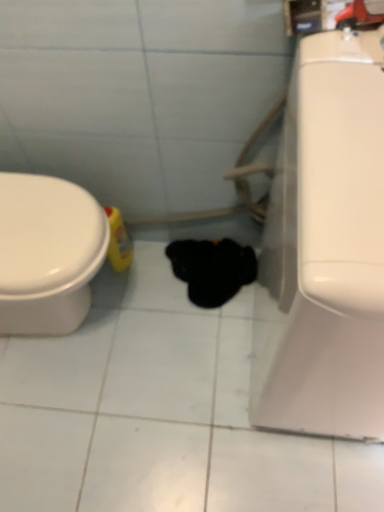
Locate an element on the screen. Image resolution: width=384 pixels, height=512 pixels. unoccupied area in front of black fuzzy cat at center is located at coordinates (205, 342).